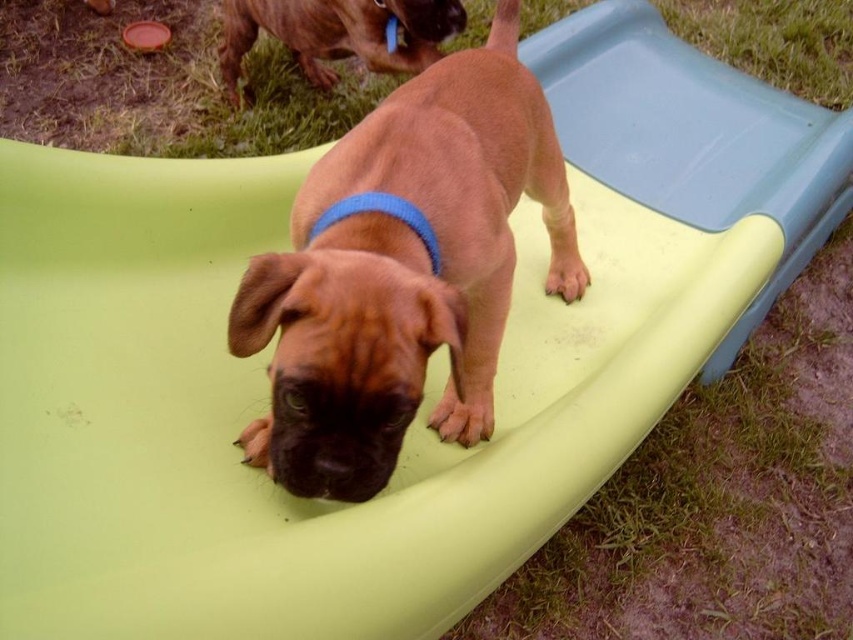
Is brown matte dog at center further to camera compared to brown glossy dog at upper center?

That is False.

Is point (268, 420) more distant than point (230, 3)?

No.

Is point (265, 426) in front of point (399, 51)?

Yes, point (265, 426) is in front of point (399, 51).

The height and width of the screenshot is (640, 853). What are the coordinates of `brown matte dog at center` in the screenshot? It's located at (403, 269).